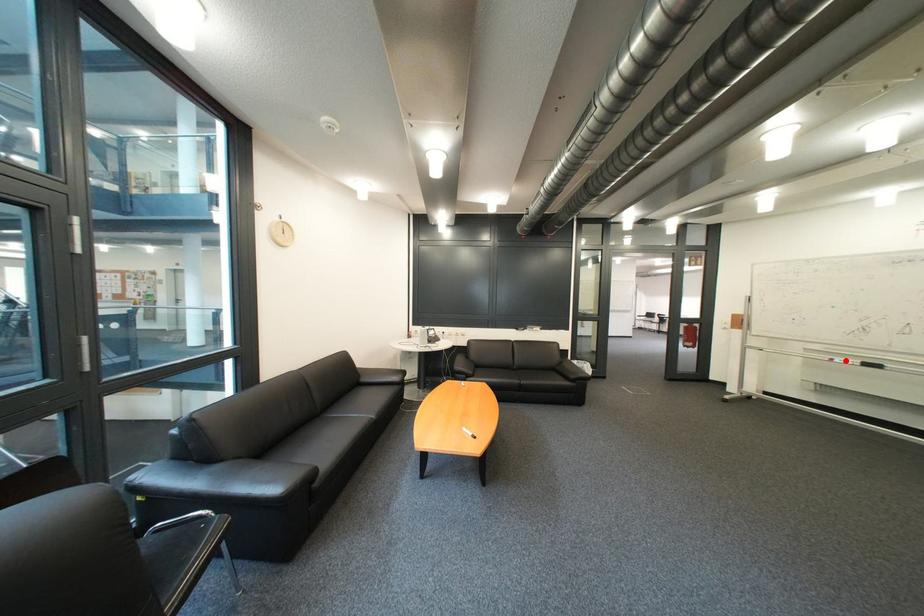
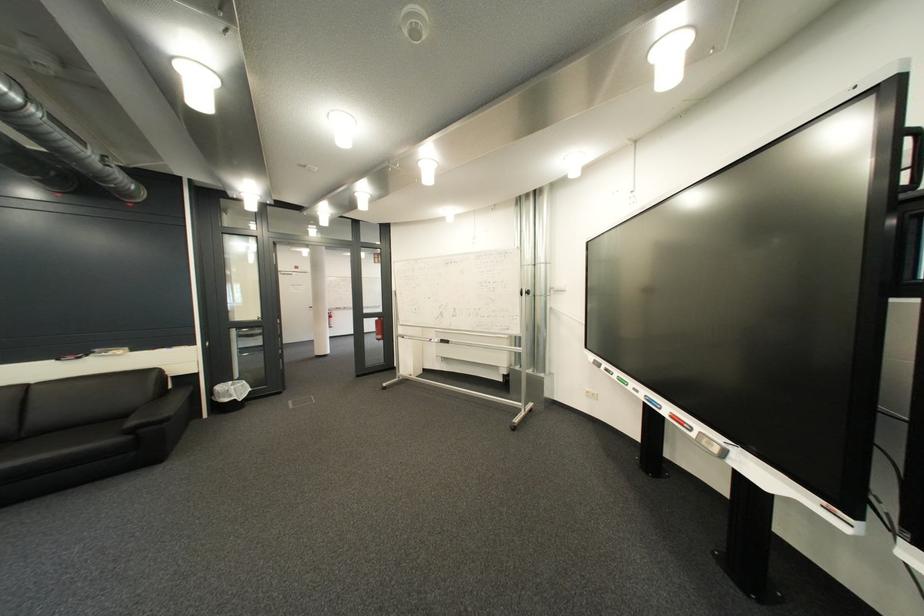
Find the pixel in the second image that matches the highlighted location in the first image.

(444, 341)